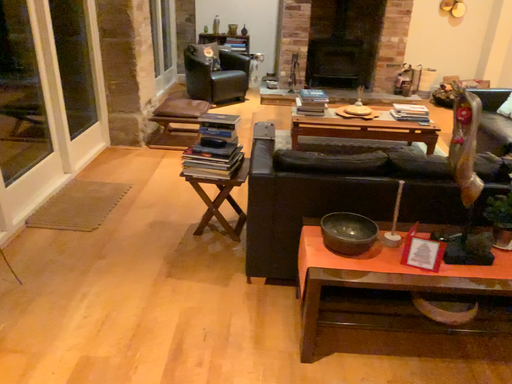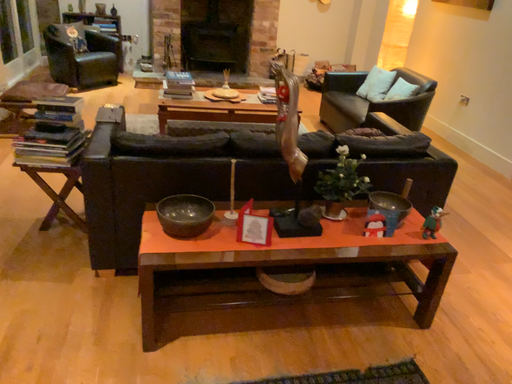
Question: How did the camera likely rotate when shooting the video?

Choices:
 (A) rotated left
 (B) rotated right

Answer: (B)